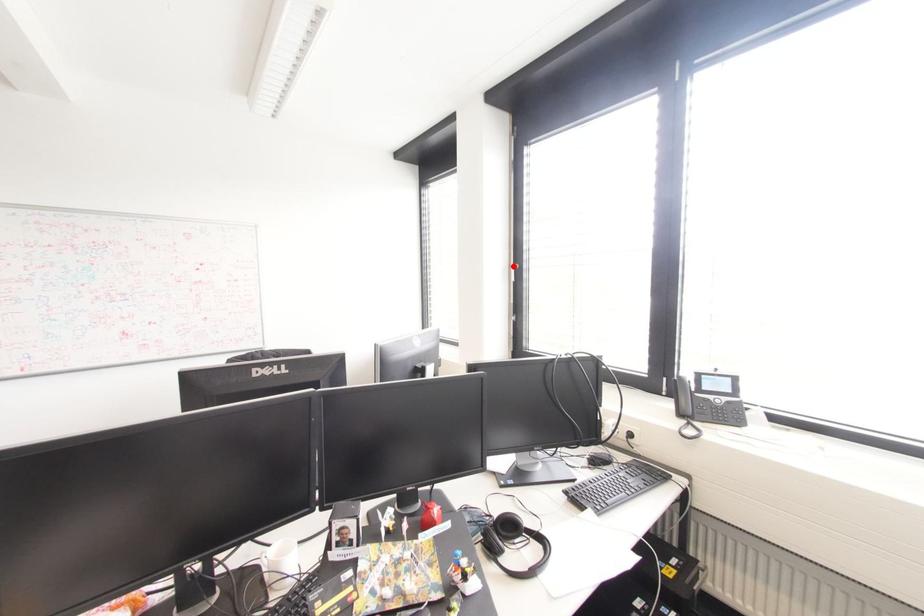
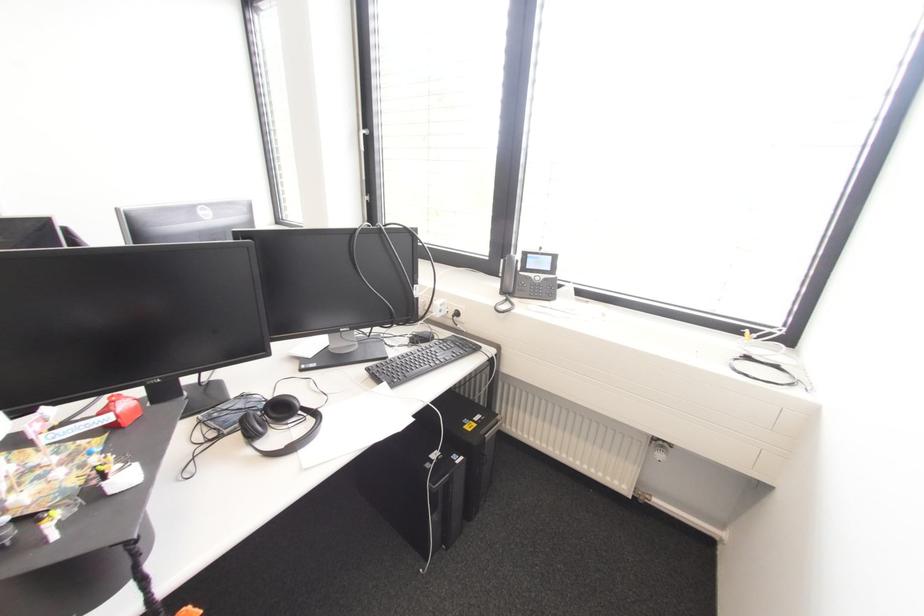
Find the pixel in the second image that matches the highlighted location in the first image.

(361, 132)